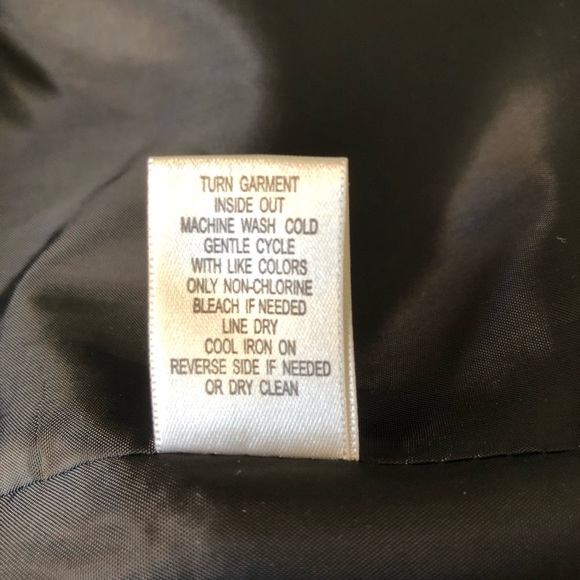
Identify the location of light on fabric. (108, 538), (72, 438), (79, 186).